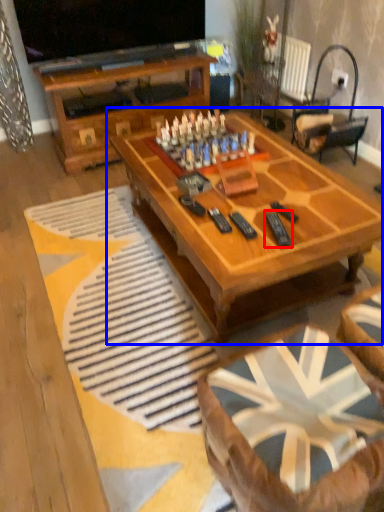
Question: Which of the following is the closest to the observer, remote (highlighted by a red box) or coffee table (highlighted by a blue box)?

Choices:
 (A) remote
 (B) coffee table

Answer: (B)